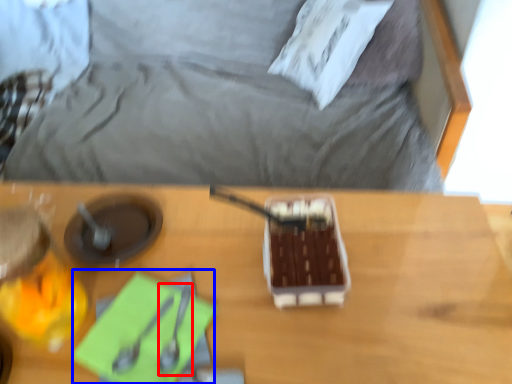
Question: Which object appears closest to the camera in this image, utensil (highlighted by a red box) or notepad (highlighted by a blue box)?

Choices:
 (A) utensil
 (B) notepad

Answer: (B)